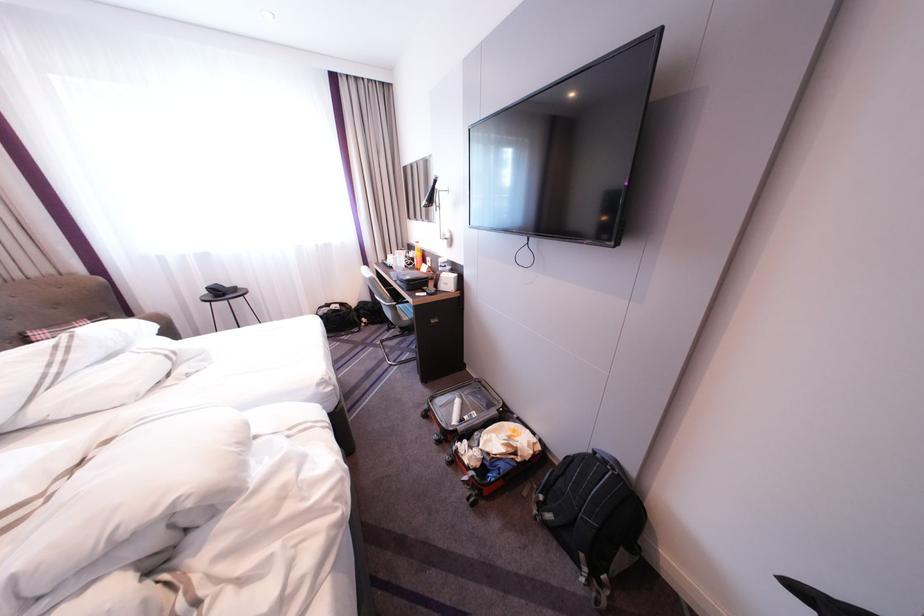
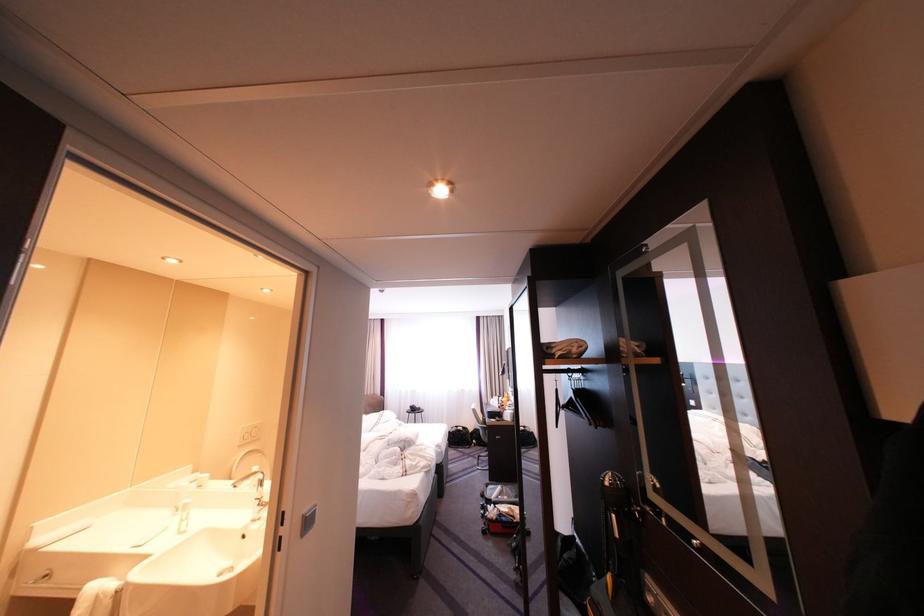
Locate, in the second image, the point that corresponds to the point at 337,313 in the first image.

(467, 431)